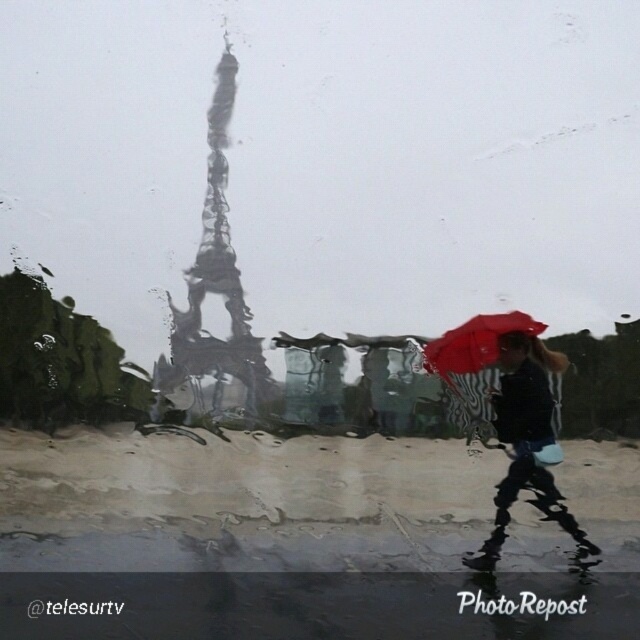
You are looking through a rain streaked window and see two points marked on the glass. The first point is at coordinate point (547,444) and the second is at point (458,337). Which point is closer to you on the glass surface?

Point (547,444) is closer to you on the glass surface because it is in front of point (458,337).

You are standing in a rainy scene and see a matte black umbrella at right. If you want to reach it without moving your feet, can you just stretch your hand out to grab it?

The matte black umbrella at right is 6.13 feet from viewer, so you cannot reach it without moving closer because the distance is greater than an average person arm length.

You are an artist trying to sketch the scene through the glass. You notice the metallic silver eiffel tower at center and the red matte umbrella at center. Which object should you draw first if you want to capture the one closer to the glass?

The red matte umbrella at center should be drawn first because it is closer to the glass than the metallic silver eiffel tower at center, as the eiffel tower is on the left side of the umbrella, implying it is further away.